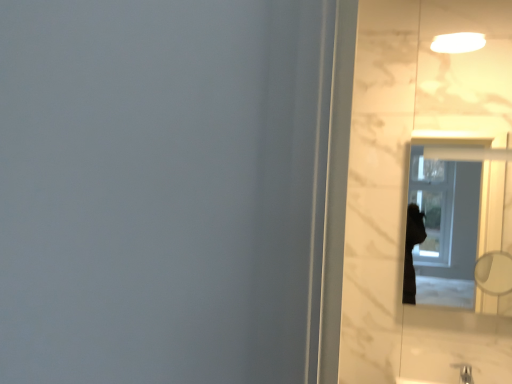
At what (x,y) coordinates should I click in order to perform the action: click on matte glass mirror at right. Please return your answer as a coordinate pair (x, y). Image resolution: width=512 pixels, height=384 pixels. Looking at the image, I should click on (460, 228).

What do you see at coordinates (460, 228) in the screenshot? The image size is (512, 384). I see `matte glass mirror at right` at bounding box center [460, 228].

The image size is (512, 384). Identify the location of matte glass mirror at right. (460, 228).